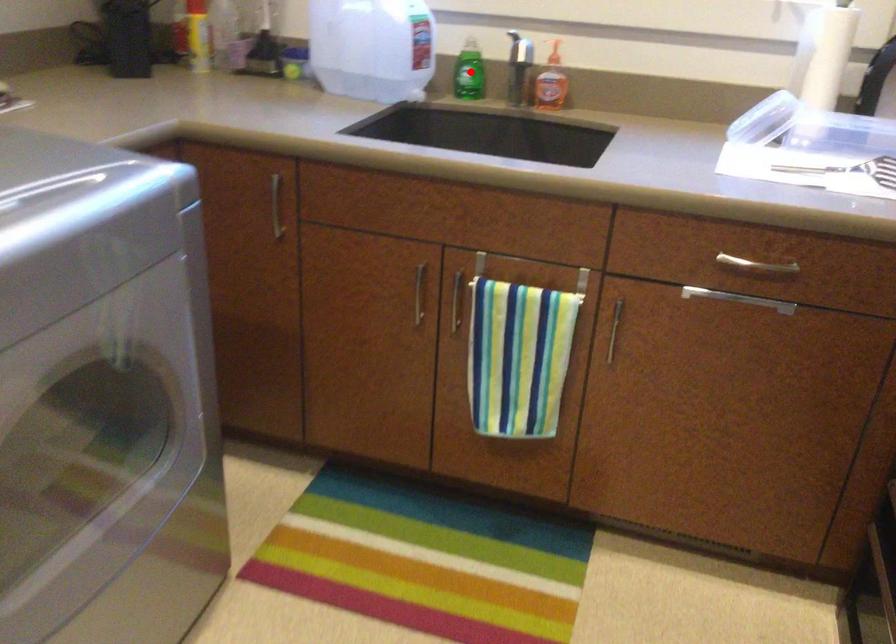
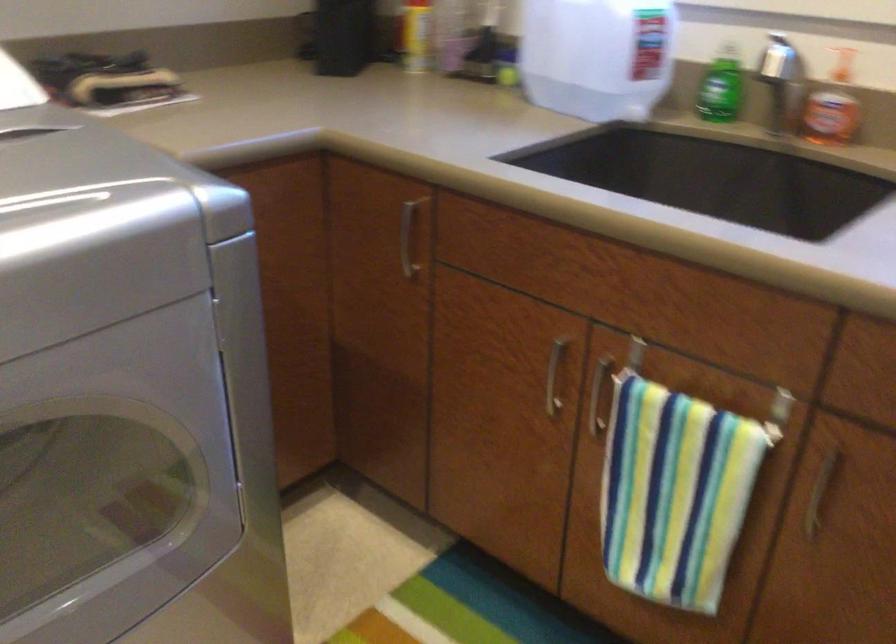
Question: I am providing you with two images of the same scene from different viewpoints. Image1 has a red point marked. In image2, the corresponding 3D location appears at what relative position? Reply with the corresponding letter.

Choices:
 (A) Closer
 (B) Farther

Answer: (A)